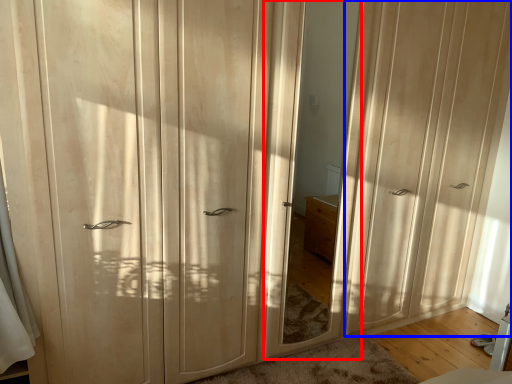
Question: Which point is closer to the camera, mirror (highlighted by a red box) or screen door (highlighted by a blue box)?

Choices:
 (A) mirror
 (B) screen door

Answer: (A)